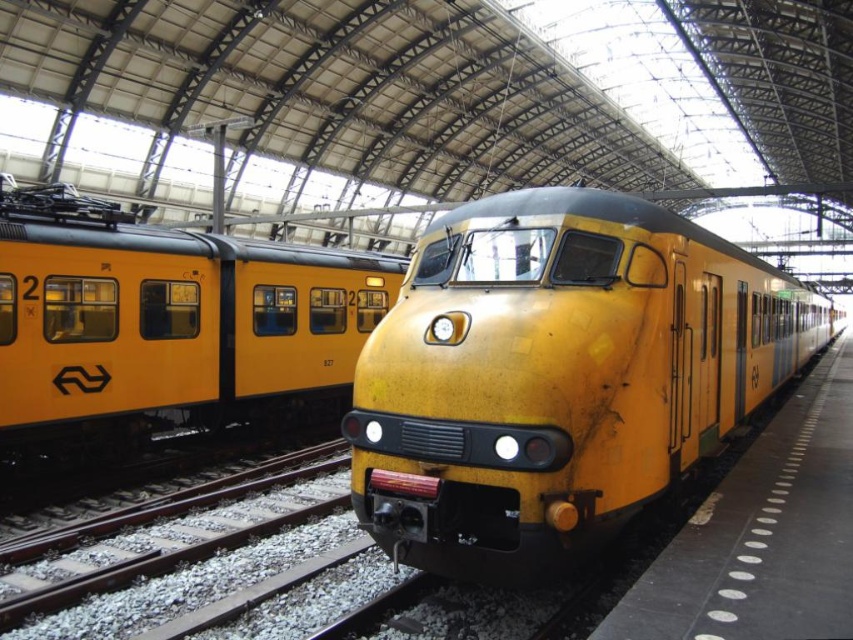
Question: Which object appears closest to the camera in this image?

Choices:
 (A) matte yellow train at center
 (B) yellow matte train at center

Answer: (B)

Question: Can you confirm if yellow matte train at center is positioned to the right of matte yellow train at center?

Choices:
 (A) yes
 (B) no

Answer: (A)

Question: Which point appears closest to the camera in this image?

Choices:
 (A) (73, 198)
 (B) (700, 323)

Answer: (B)

Question: Is yellow matte train at center bigger than matte yellow train at center?

Choices:
 (A) no
 (B) yes

Answer: (A)

Question: Is yellow matte train at center wider than matte yellow train at center?

Choices:
 (A) no
 (B) yes

Answer: (B)

Question: Which point is farther to the camera?

Choices:
 (A) (787, 333)
 (B) (131, 256)

Answer: (A)